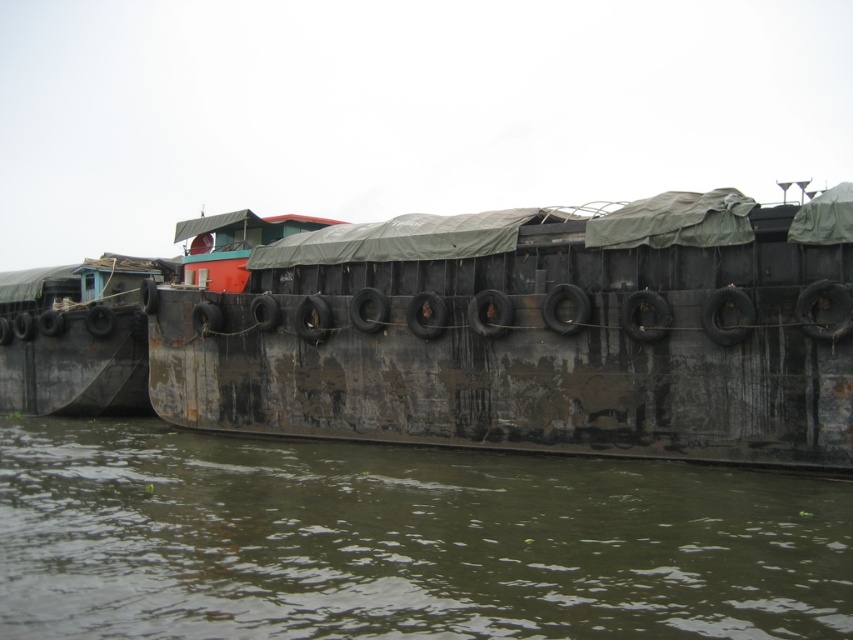
Which is more to the left, brown murky water at lower center or rusty metal barge at center?

brown murky water at lower center is more to the left.

Is brown murky water at lower center smaller than rusty metal barge at center?

Correct, brown murky water at lower center occupies less space than rusty metal barge at center.

What do you see at coordinates (401, 541) in the screenshot? The width and height of the screenshot is (853, 640). I see `brown murky water at lower center` at bounding box center [401, 541].

The height and width of the screenshot is (640, 853). I want to click on brown murky water at lower center, so [401, 541].

Does rusty metal barge at center appear under rusty metal barge at left?

Yes, rusty metal barge at center is below rusty metal barge at left.

Can you confirm if rusty metal barge at center is positioned above rusty metal barge at left?

→ Actually, rusty metal barge at center is below rusty metal barge at left.

Which is behind, point (648, 340) or point (82, 278)?

Point (82, 278)

You are a GUI agent. You are given a task and a screenshot of the screen. Output one action in this format:
    pyautogui.click(x=<x>, y=<y>)
    Task: Click on the rusty metal barge at center
    This screenshot has width=853, height=640.
    Given the screenshot: What is the action you would take?
    pyautogui.click(x=535, y=332)

Is brown murky water at lower center above rusty metal barge at left?

Incorrect, brown murky water at lower center is not positioned above rusty metal barge at left.

Who is taller, brown murky water at lower center or rusty metal barge at left?

rusty metal barge at left

Does point (653, 577) come in front of point (122, 257)?

That is True.

Identify the location of brown murky water at lower center. (401, 541).